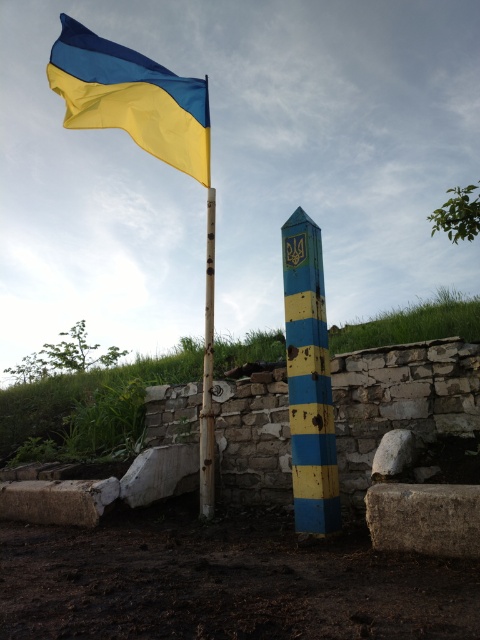
Question: Which point is closer to the camera taking this photo?

Choices:
 (A) (132, 65)
 (B) (201, 448)

Answer: (B)

Question: Which of the following is the closest to the observer?

Choices:
 (A) smooth wood pole at center
 (B) blue/yellow striped pole at center

Answer: (B)

Question: Does yellow-blue fabric flag at upper left have a larger size compared to smooth wood pole at center?

Choices:
 (A) no
 (B) yes

Answer: (B)

Question: Does yellow-blue fabric flag at upper left lie in front of blue/yellow striped pole at center?

Choices:
 (A) no
 (B) yes

Answer: (A)

Question: Estimate the real-world distances between objects in this image. Which object is closer to the yellow-blue fabric flag at upper left?

Choices:
 (A) smooth wood pole at center
 (B) blue/yellow striped pole at center

Answer: (B)

Question: Considering the relative positions of blue/yellow striped pole at center and smooth wood pole at center in the image provided, where is blue/yellow striped pole at center located with respect to smooth wood pole at center?

Choices:
 (A) above
 (B) below

Answer: (A)